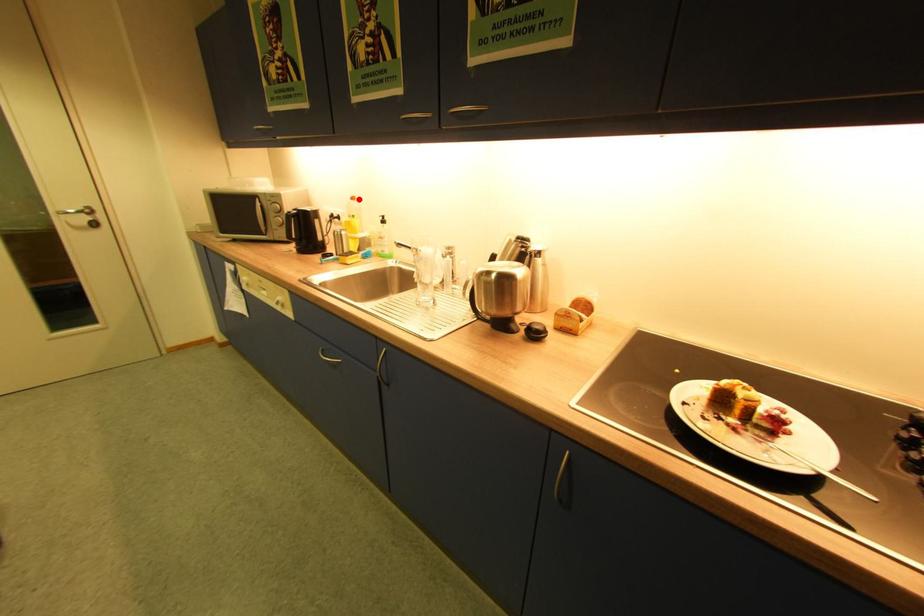
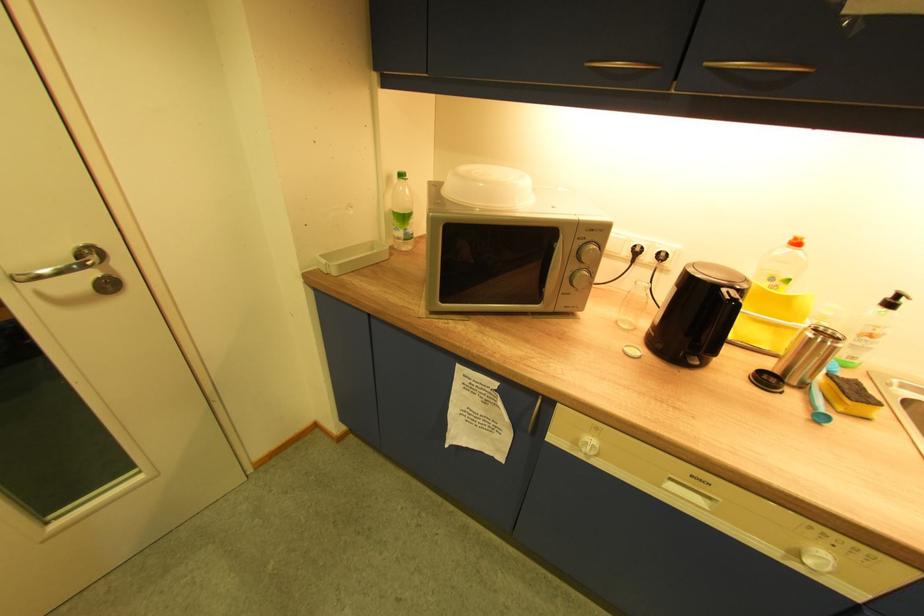
Find the pixel in the second image that matches the highlighted location in the first image.

(803, 244)